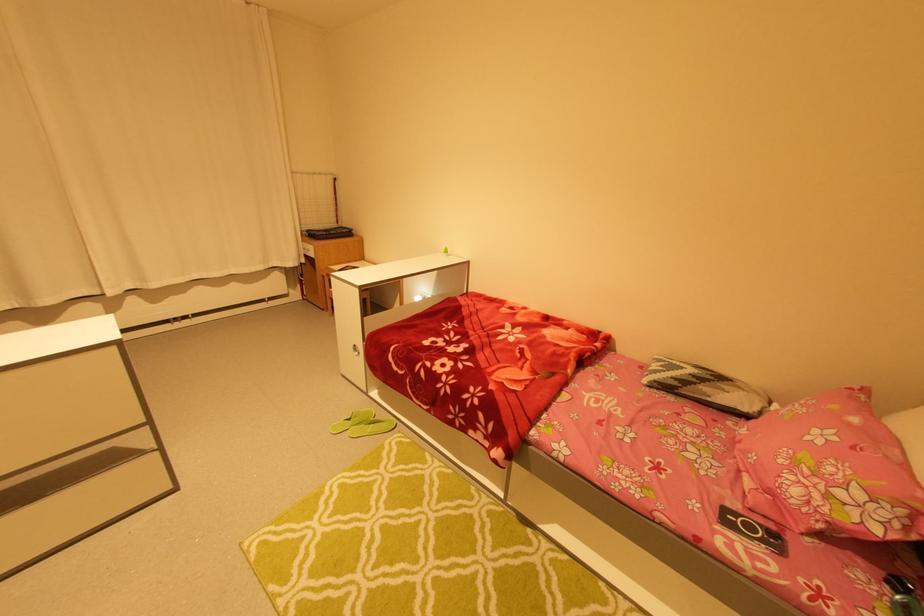
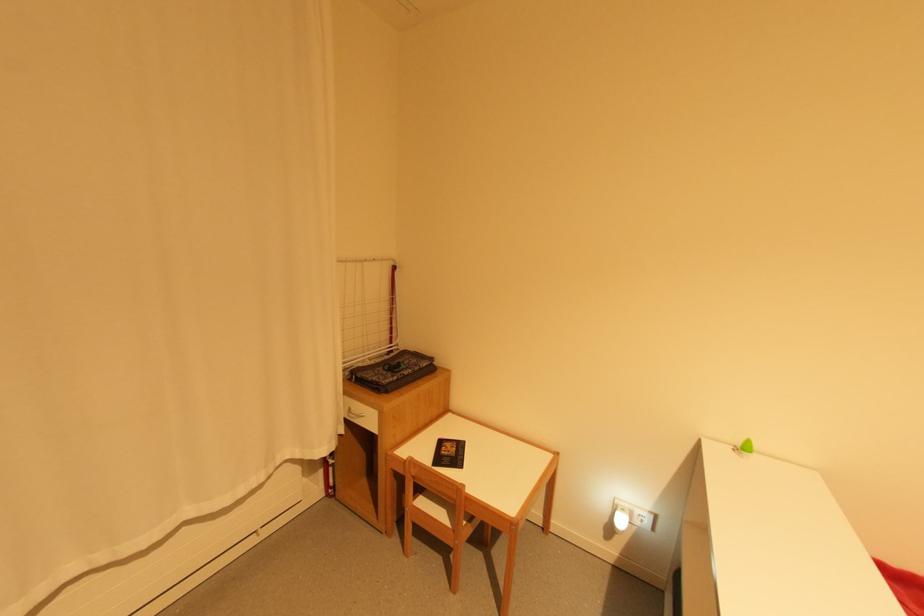
Locate, in the second image, the point that corresponds to (x=344, y=232) in the first image.

(421, 369)